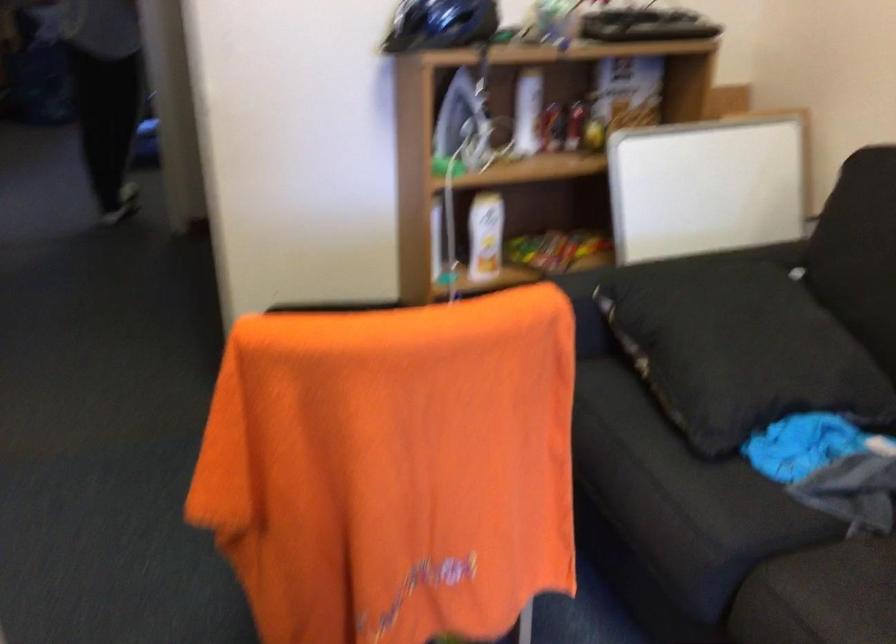
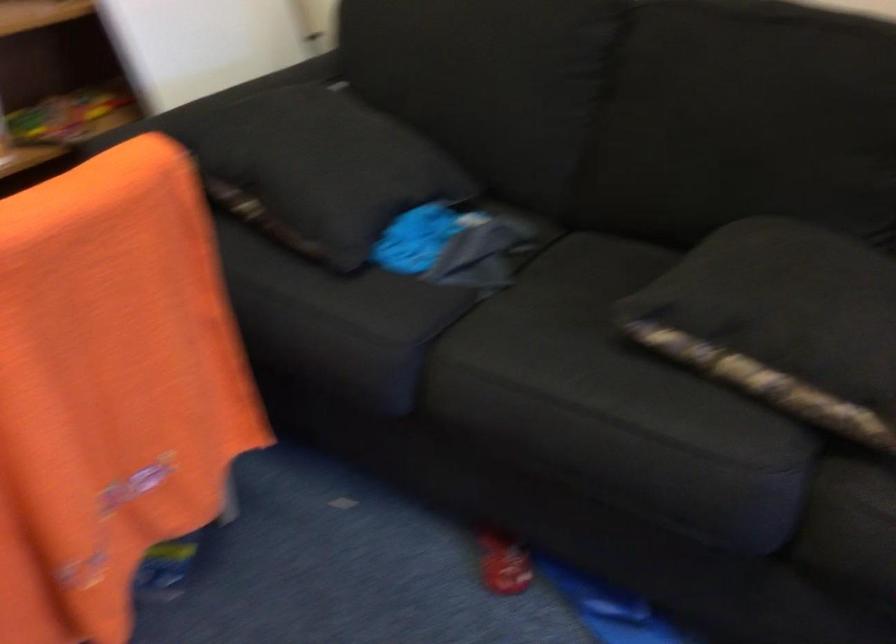
Where in the second image is the point corresponding to point 718,350 from the first image?

(321, 169)